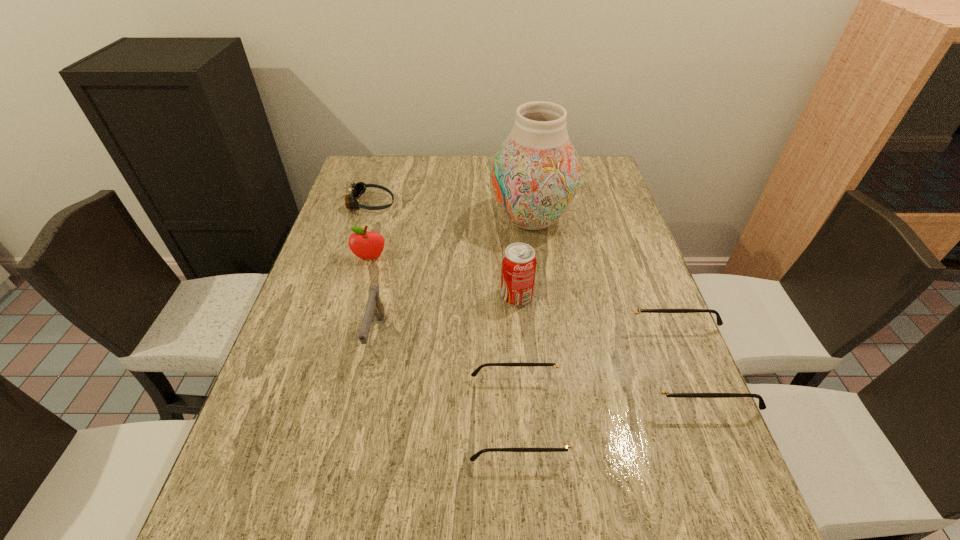
Where is `apple at the left edge`? apple at the left edge is located at coordinates (366, 245).

The width and height of the screenshot is (960, 540). Find the location of `goggles located at the left edge`. goggles located at the left edge is located at coordinates (356, 190).

This screenshot has height=540, width=960. In order to click on spectacles positioned at the right edge in this screenshot , I will do `click(655, 385)`.

Identify the location of vase that is at the right edge. The image size is (960, 540). (535, 174).

What are the coordinates of `object that is at the far left corner` in the screenshot? It's located at (356, 190).

In the image, there is a desktop. What are the coordinates of `blank space at the far edge` in the screenshot? It's located at (x=405, y=159).

Image resolution: width=960 pixels, height=540 pixels. I want to click on free space at the near edge of the desktop, so click(511, 442).

Image resolution: width=960 pixels, height=540 pixels. In the image, there is a desktop. Identify the location of free space at the left edge. (323, 305).

In the image, there is a desktop. At what (x,y) coordinates should I click in order to perform the action: click on vacant space at the right edge. Please return your answer as a coordinate pair (x, y). Looking at the image, I should click on (611, 222).

Identify the location of vacant space at the far left corner of the desktop. The image size is (960, 540). (393, 160).